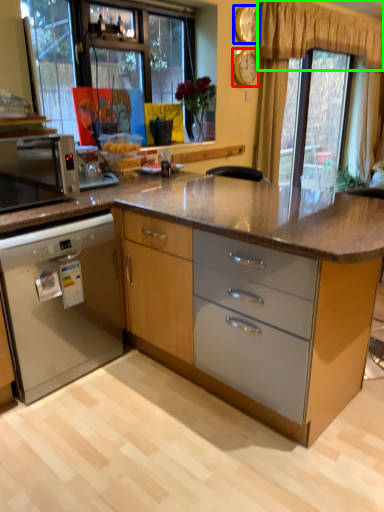
Question: Which object is positioned farthest from clock (highlighted by a red box)? Select from clock (highlighted by a blue box) and curtain (highlighted by a green box).

Choices:
 (A) clock
 (B) curtain

Answer: (B)